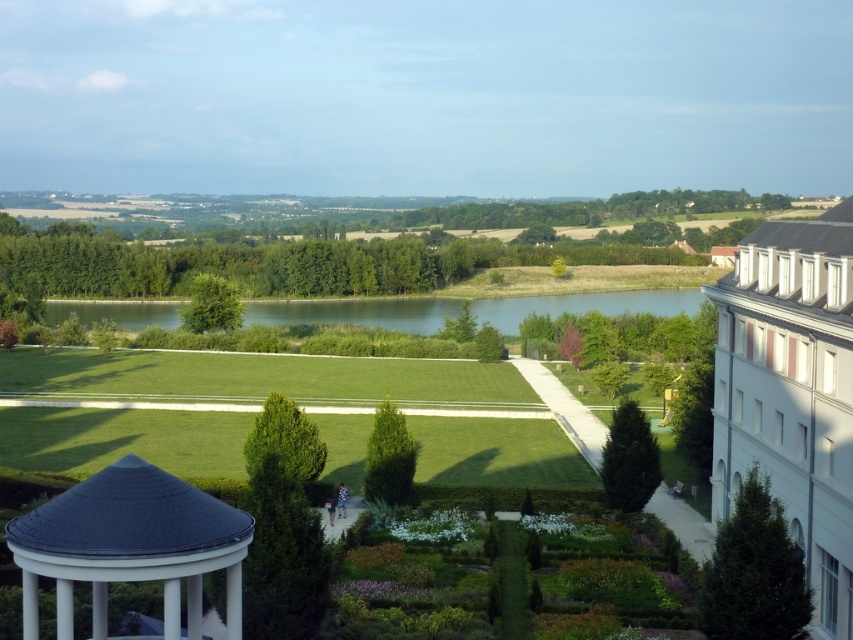
Question: Is white textured gazebo at lower left wider than green smooth water at center?

Choices:
 (A) no
 (B) yes

Answer: (A)

Question: Which of the following is the farthest from the observer?

Choices:
 (A) [x=691, y=296]
 (B) [x=120, y=470]

Answer: (A)

Question: Which object appears farthest from the camera in this image?

Choices:
 (A) white textured gazebo at lower left
 (B) green smooth water at center

Answer: (B)

Question: Is white textured gazebo at lower left bigger than green smooth water at center?

Choices:
 (A) no
 (B) yes

Answer: (A)

Question: Does white textured gazebo at lower left lie behind green smooth water at center?

Choices:
 (A) yes
 (B) no

Answer: (B)